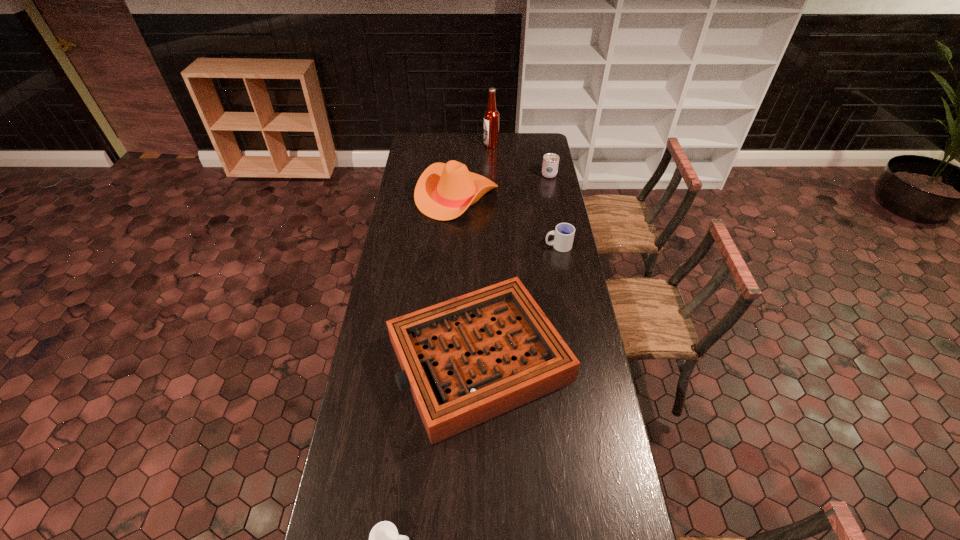
Identify the location of vacant area that lies between the second nearest cup and the tallest object. (524, 195).

Point out which object is positioned as the third nearest to the nearest cup. Please provide its 2D coordinates. Your answer should be formatted as a tuple, i.e. [(x, y)], where the tuple contains the x and y coordinates of a point satisfying the conditions above.

[(443, 192)]

Where is `the closest object relative to the alcohol`? the closest object relative to the alcohol is located at coordinates (443, 192).

At what (x,y) coordinates should I click in order to perform the action: click on cup object that ranks as the second closest to the nearest object. Please return your answer as a coordinate pair (x, y). Image resolution: width=960 pixels, height=540 pixels. Looking at the image, I should click on (550, 160).

Select which cup is the third closest to the fifth farthest object. Please provide its 2D coordinates. Your answer should be formatted as a tuple, i.e. [(x, y)], where the tuple contains the x and y coordinates of a point satisfying the conditions above.

[(550, 160)]

This screenshot has height=540, width=960. What are the coordinates of `vacant space that satisfies the following two spatial constraints: 1. on the side with the handle of the tallest cup; 2. on the label side of the alcohol` in the screenshot? It's located at (543, 145).